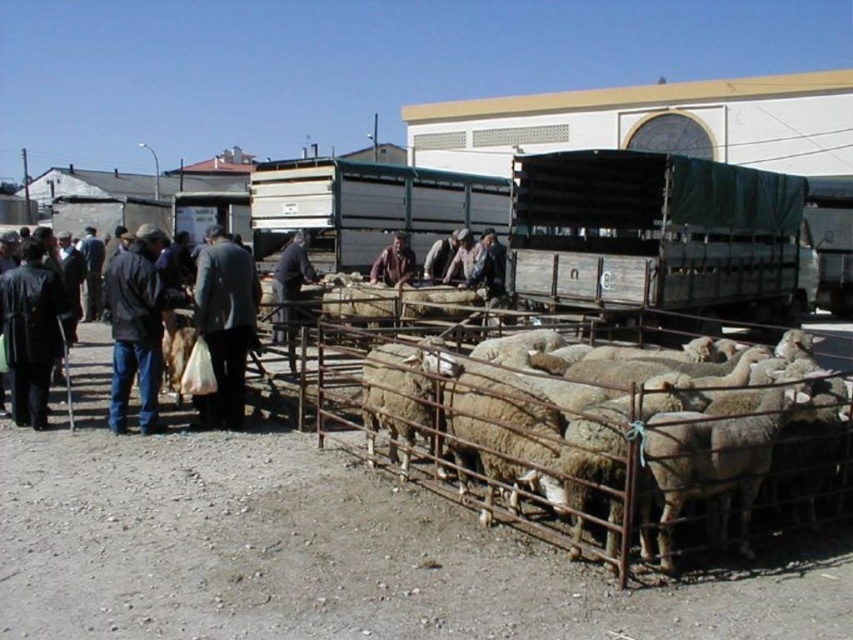
You are a GUI agent. You are given a task and a screenshot of the screen. Output one action in this format:
    pyautogui.click(x=<x>, y=<y>)
    Task: Click on the white woolen sheep at center
    This screenshot has height=640, width=853.
    Given the screenshot: What is the action you would take?
    pyautogui.click(x=659, y=451)

Which of these two, white woolen sheep at center or dark blue jeans at center, stands taller?

With more height is dark blue jeans at center.

Is point (753, 490) behind point (151, 317)?

No, (753, 490) is closer to viewer.

I want to click on white woolen sheep at center, so click(x=659, y=451).

Can you confirm if white woolen sheep at center is thinner than wooden wagon at center?

Correct, white woolen sheep at center's width is less than wooden wagon at center's.

The height and width of the screenshot is (640, 853). What do you see at coordinates (659, 451) in the screenshot? I see `white woolen sheep at center` at bounding box center [659, 451].

Between point (495, 476) and point (386, 214), which one is positioned in front?

Point (495, 476)

Where is `white woolen sheep at center`? white woolen sheep at center is located at coordinates [x=659, y=451].

Between green tarpaulin wagon at center and brown woolen sweater at center, which one appears on the right side from the viewer's perspective?

From the viewer's perspective, green tarpaulin wagon at center appears more on the right side.

Who is more distant from viewer, (693, 225) or (409, 275)?

Point (409, 275)

Between point (619, 177) and point (408, 259), which one is positioned in front?

Point (619, 177) is in front.

Locate an element on the screen. This screenshot has width=853, height=640. green tarpaulin wagon at center is located at coordinates (656, 234).